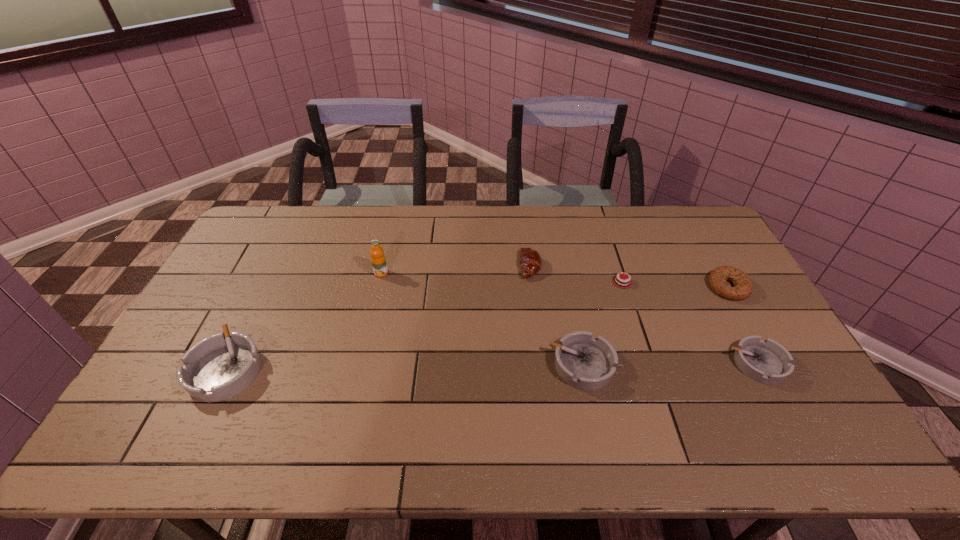
This screenshot has height=540, width=960. I want to click on unoccupied area between the crescent roll and the second tallest ashtray, so click(x=556, y=316).

Find the location of `vacant region between the second shortest ashtray and the rightmost ashtray`. vacant region between the second shortest ashtray and the rightmost ashtray is located at coordinates (669, 364).

The height and width of the screenshot is (540, 960). Identify the location of vacant area that lies between the chocolate cake and the rightmost ashtray. (690, 323).

Where is `vacant space that's between the shortest ashtray and the leftmost object`? The height and width of the screenshot is (540, 960). vacant space that's between the shortest ashtray and the leftmost object is located at coordinates [492, 366].

Image resolution: width=960 pixels, height=540 pixels. I want to click on vacant space that's between the crescent roll and the rightmost ashtray, so click(644, 315).

Where is `unoccupied area between the orange juice and the crescent roll`? This screenshot has height=540, width=960. unoccupied area between the orange juice and the crescent roll is located at coordinates (456, 269).

Choose which object is the fifth nearest neighbor to the shortest ashtray. Please provide its 2D coordinates. Your answer should be formatted as a tuple, i.e. [(x, y)], where the tuple contains the x and y coordinates of a point satisfying the conditions above.

[(378, 260)]

This screenshot has height=540, width=960. What are the coordinates of `object that stands as the fifth closest to the chocolate cake` in the screenshot? It's located at (378, 260).

Identify the location of ashtray that is the second closest to the rightmost ashtray. The image size is (960, 540). (220, 366).

Identify which ashtray is the second closest to the leftmost ashtray. Please provide its 2D coordinates. Your answer should be formatted as a tuple, i.e. [(x, y)], where the tuple contains the x and y coordinates of a point satisfying the conditions above.

[(766, 361)]